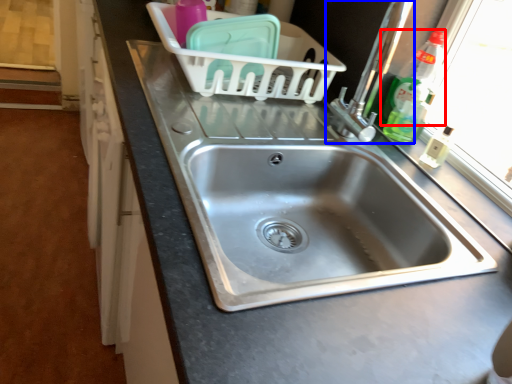
Question: Which of the following is the farthest to the observer, bottle (highlighted by a red box) or tap (highlighted by a blue box)?

Choices:
 (A) bottle
 (B) tap

Answer: (A)